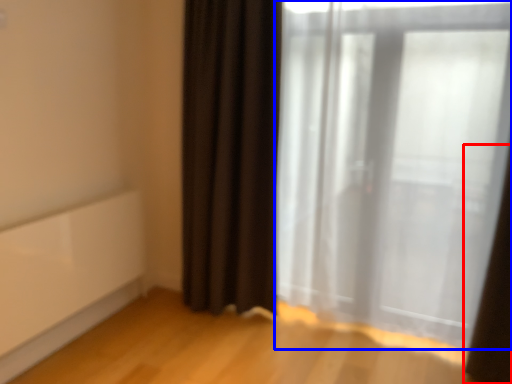
Question: Which object appears closest to the camera in this image, curtain (highlighted by a red box) or curtain (highlighted by a blue box)?

Choices:
 (A) curtain
 (B) curtain

Answer: (A)